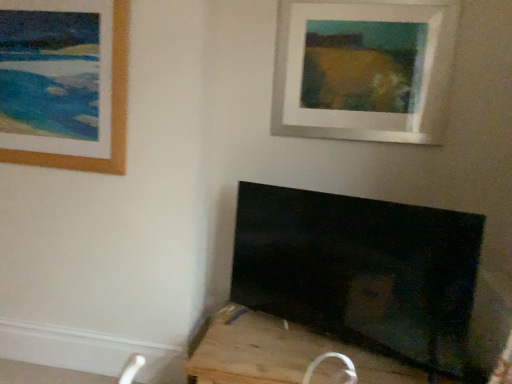
Question: In the image, is white matte picture frame at upper center, the second picture frame when ordered from left to right, positioned in front of or behind wooden frame at upper left, the first picture frame viewed from the left?

Choices:
 (A) front
 (B) behind

Answer: (B)

Question: Is white matte picture frame at upper center, the first picture frame when ordered from right to left, taller or shorter than wooden frame at upper left, the first picture frame viewed from the left?

Choices:
 (A) tall
 (B) short

Answer: (B)

Question: Which object is positioned farthest from the black matte tv at lower right?

Choices:
 (A) white matte picture frame at upper center, the first picture frame when ordered from right to left
 (B) wooden frame at upper left, the first picture frame viewed from the left

Answer: (A)

Question: Which of these objects is positioned closest to the white matte picture frame at upper center, the first picture frame when ordered from right to left?

Choices:
 (A) black matte tv at lower right
 (B) wooden frame at upper left, the first picture frame viewed from the left

Answer: (B)